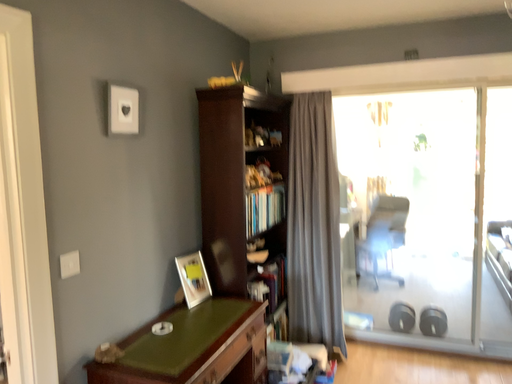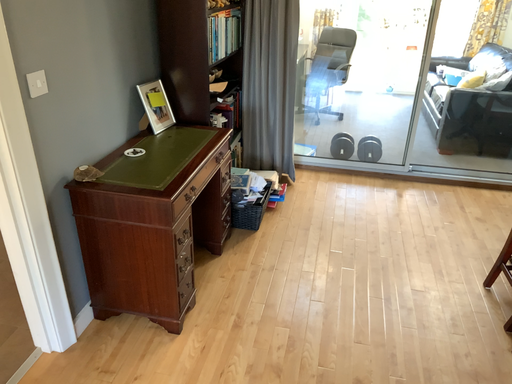
Question: How did the camera likely rotate when shooting the video?

Choices:
 (A) rotated left
 (B) rotated right

Answer: (B)